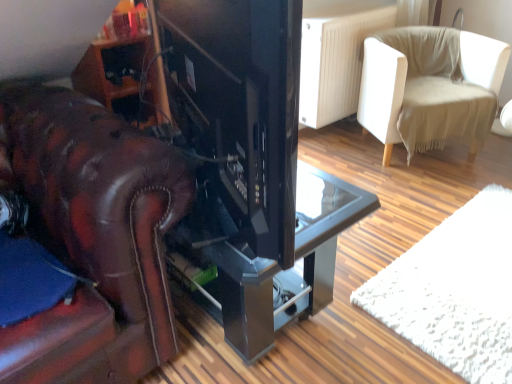
Question: From a real-world perspective, is glossy black table at center above or below beige fabric chair at upper right?

Choices:
 (A) below
 (B) above

Answer: (A)

Question: Is glossy black table at center to the left or to the right of beige fabric chair at upper right in the image?

Choices:
 (A) right
 (B) left

Answer: (B)

Question: Estimate the real-world distances between objects in this image. Which object is closer to the glossy black table at center?

Choices:
 (A) matte black tv at center
 (B) beige fabric chair at upper right

Answer: (A)

Question: Which object is positioned farthest from the beige fabric chair at upper right?

Choices:
 (A) glossy black table at center
 (B) matte black tv at center

Answer: (B)